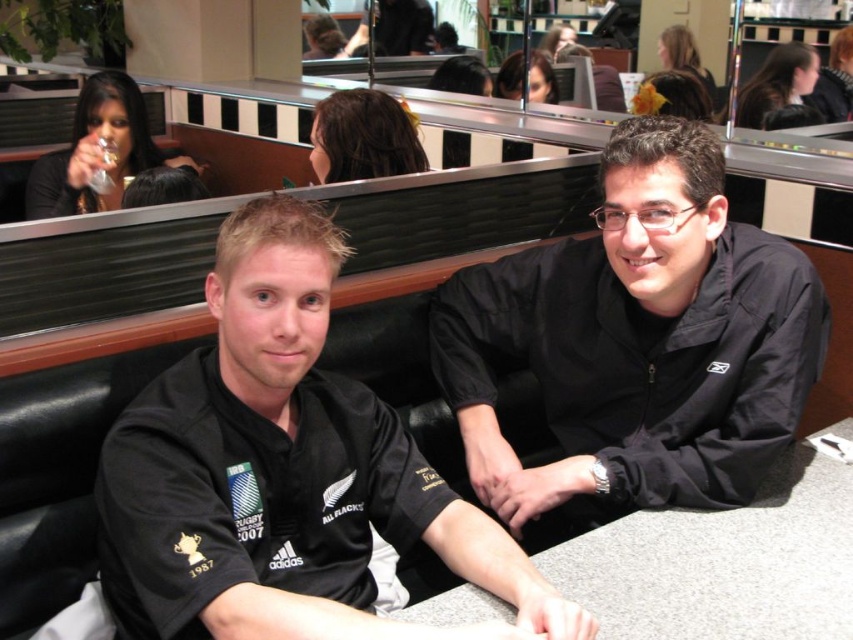
Which is behind, point (303, 602) or point (552, 266)?

Point (552, 266)

Is point (221, 609) more distant than point (712, 237)?

No, it is not.

Identify the location of black jersey at center. (283, 474).

Does black matte jacket at center appear on the right side of gray laminate table at center?

Incorrect, black matte jacket at center is not on the right side of gray laminate table at center.

Is black matte jacket at center shorter than gray laminate table at center?

No, black matte jacket at center is not shorter than gray laminate table at center.

Who is more forward, (514, 342) or (744, 596)?

Point (744, 596) is in front.

Locate an element on the screen. The height and width of the screenshot is (640, 853). black matte jacket at center is located at coordinates (637, 340).

Based on the photo, who is taller, black jersey at center or gray laminate table at center?

With more height is black jersey at center.

Does black jersey at center appear on the left side of gray laminate table at center?

Indeed, black jersey at center is positioned on the left side of gray laminate table at center.

This screenshot has height=640, width=853. Find the location of `black jersey at center`. black jersey at center is located at coordinates (283, 474).

Locate an element on the screen. black jersey at center is located at coordinates (283, 474).